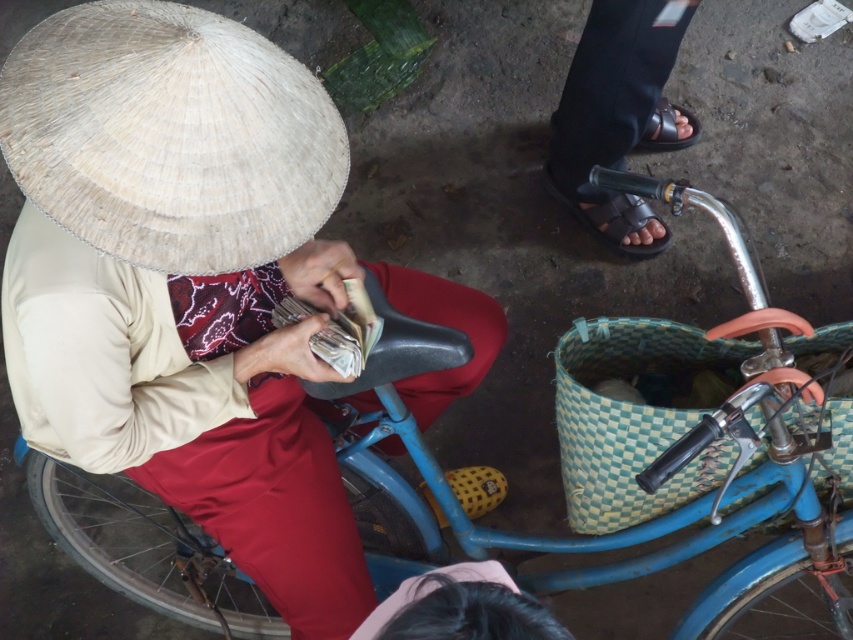
You are a delivery drone trying to land in the area between the natural straw hat at upper left and the black rubber sandal at lower right. The drone requires a minimum of 1 meter of vertical clearance to safely descend. Can you determine if the space between them is tall enough based on their positions?

The natural straw hat at upper left is taller than the black rubber sandal at lower right. Since the drone needs at least 1 meter of vertical clearance, but the exact height difference isn not provided, we cannot confirm if the space is sufficient. Please check the actual height difference.

You are a delivery person trying to place a package in the green woven basket at lower right. However, there is a black rubber sandal at upper right in the way. Can you place the package in the basket without moving the sandal?

The green woven basket at lower right is located below the black rubber sandal at upper right. Since the basket is positioned lower than the sandal, you can place the package in the basket without needing to move the sandal as they are not in the same vertical plane.

You are a delivery person standing at the front of the bicycle. You need to place a small package into the green woven basket at lower right and then put on your black rubber sandal at upper right. Which task should you do first based on their positions?

You should place the small package into the green woven basket at lower right first because it is to the left of the black rubber sandal at upper right, meaning it is closer to your current position at the front of the bicycle.